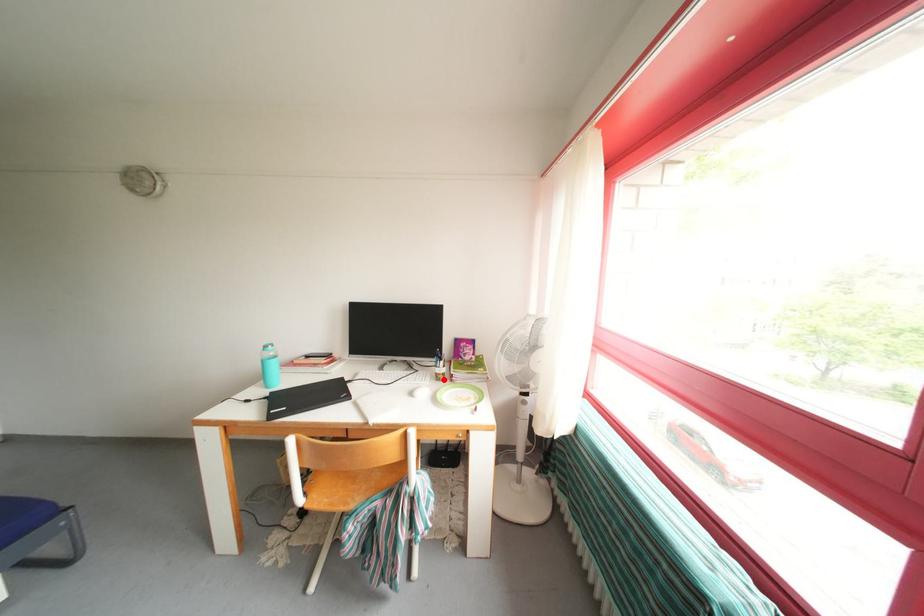
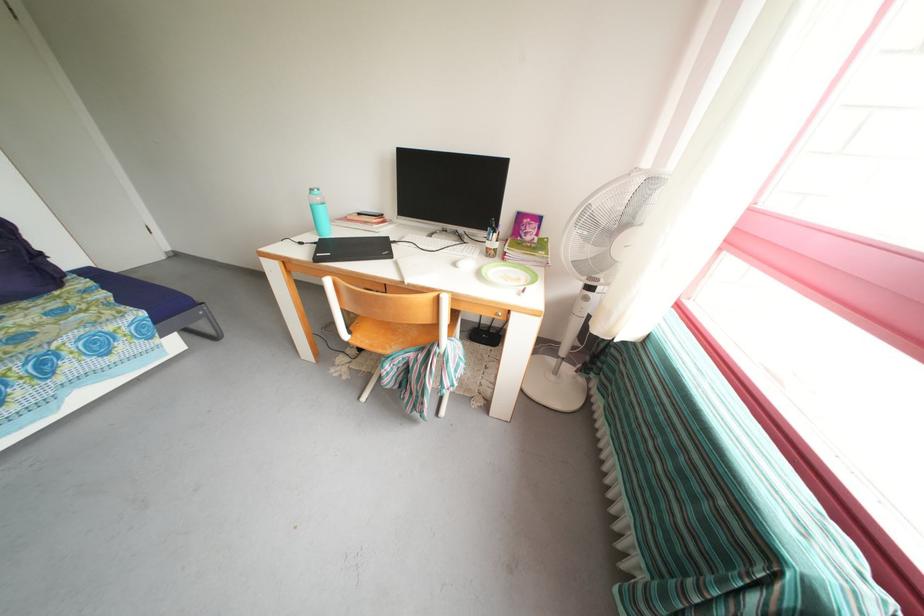
Find the pixel in the second image that matches the highlighted location in the first image.

(494, 254)